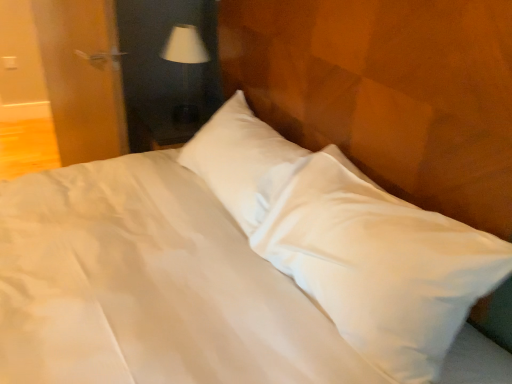
Image resolution: width=512 pixels, height=384 pixels. Identify the location of vacant area that is in front of white fabric lampshade at upper center. (170, 130).